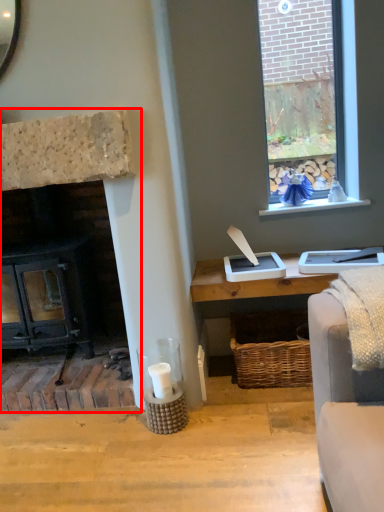
Question: From the image's perspective, considering the relative positions of fireplace (annotated by the red box) and window sill in the image provided, where is fireplace (annotated by the red box) located with respect to the staircase?

Choices:
 (A) above
 (B) below

Answer: (B)